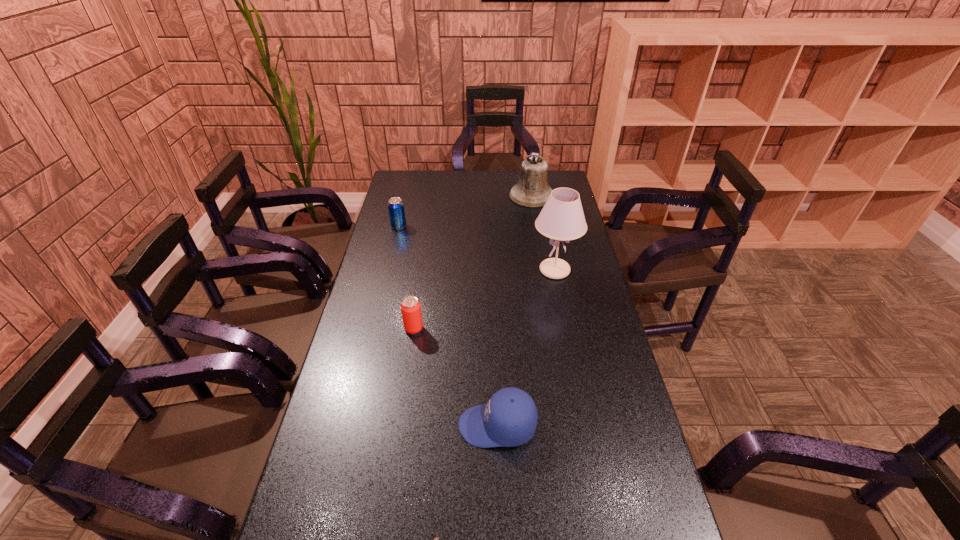
Where is `free location located 0.060m on the left of the farthest object`? free location located 0.060m on the left of the farthest object is located at coordinates (496, 195).

You are a GUI agent. You are given a task and a screenshot of the screen. Output one action in this format:
    pyautogui.click(x=<x>, y=<y>)
    Task: Click on the free location located on the front of the second farthest object
    The image size is (960, 540).
    Given the screenshot: What is the action you would take?
    pyautogui.click(x=388, y=269)

The image size is (960, 540). I want to click on vacant space located on the back of the nearer beer can, so click(x=423, y=267).

This screenshot has height=540, width=960. I want to click on free space located on the front-facing side of the second nearest object, so click(x=342, y=426).

Identify the location of vacant space situated 0.240m on the front-facing side of the second nearest object. This screenshot has width=960, height=540. (368, 426).

Identify the location of vacant space located on the front-facing side of the second nearest object. The image size is (960, 540). (406, 426).

At what (x,y) coordinates should I click in order to perform the action: click on object that is positioned at the far edge. Please return your answer as a coordinate pair (x, y). The image size is (960, 540). Looking at the image, I should click on (532, 190).

Image resolution: width=960 pixels, height=540 pixels. I want to click on object present at the left edge, so click(396, 210).

This screenshot has height=540, width=960. I want to click on lampshade situated at the right edge, so click(562, 218).

Locate an element on the screen. The width and height of the screenshot is (960, 540). bell that is at the right edge is located at coordinates (532, 190).